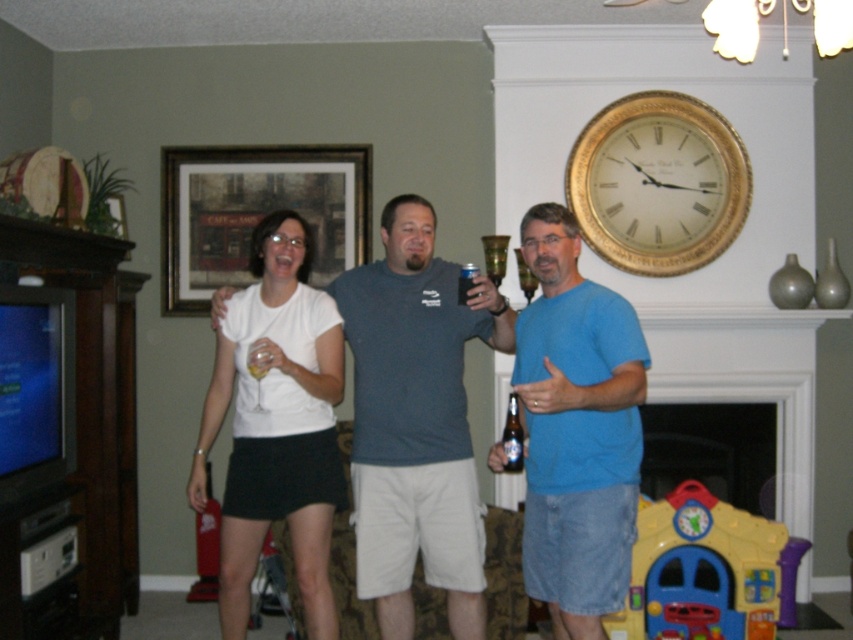
Can you confirm if blue denim shorts at center is positioned below white matte t-shirt at center?

Actually, blue denim shorts at center is above white matte t-shirt at center.

Which is more to the left, blue denim shorts at center or white matte t-shirt at center?

white matte t-shirt at center is more to the left.

This screenshot has width=853, height=640. What are the coordinates of `blue denim shorts at center` in the screenshot? It's located at (576, 429).

Based on the photo, does white matte picture frame at upper center appear over plastic yellow playhouse at lower right?

Correct, white matte picture frame at upper center is located above plastic yellow playhouse at lower right.

Who is more distant from viewer, (256, 186) or (724, 621)?

Point (256, 186)

The height and width of the screenshot is (640, 853). Find the location of `white matte picture frame at upper center`. white matte picture frame at upper center is located at coordinates coord(256,212).

Who is positioned more to the right, matte gray t-shirt at center or plastic yellow playhouse at lower right?

plastic yellow playhouse at lower right

Does matte gray t-shirt at center have a lesser height compared to plastic yellow playhouse at lower right?

No.

Is point (412, 566) farther from camera compared to point (732, 628)?

No, (412, 566) is closer to viewer.

The height and width of the screenshot is (640, 853). I want to click on matte gray t-shirt at center, so click(x=416, y=420).